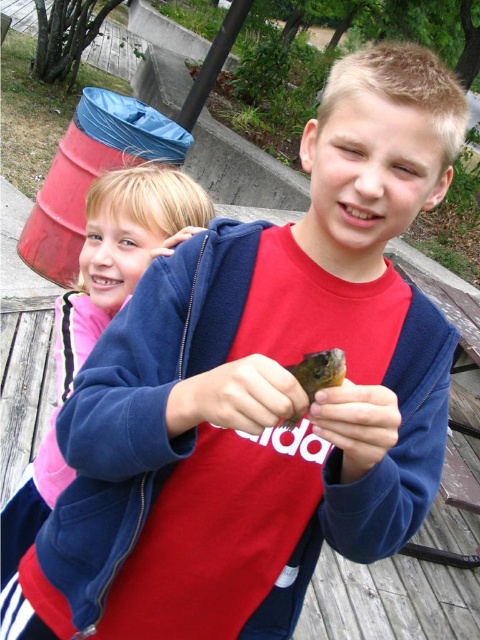
You are a photographer trying to capture both the blue fleece jacket at upper left and the smooth skin hand at center in a single shot. Based on their positions, which object should you focus on first to ensure both are in frame?

The blue fleece jacket at upper left is located above the smooth skin hand at center, so you should focus on the blue fleece jacket at upper left first to ensure both are in frame.

Looking at the scene, which hand is positioned to the left between the smooth skin hand at center and the brown matte hand at center?

The smooth skin hand at center is positioned to the left of the brown matte hand at center.